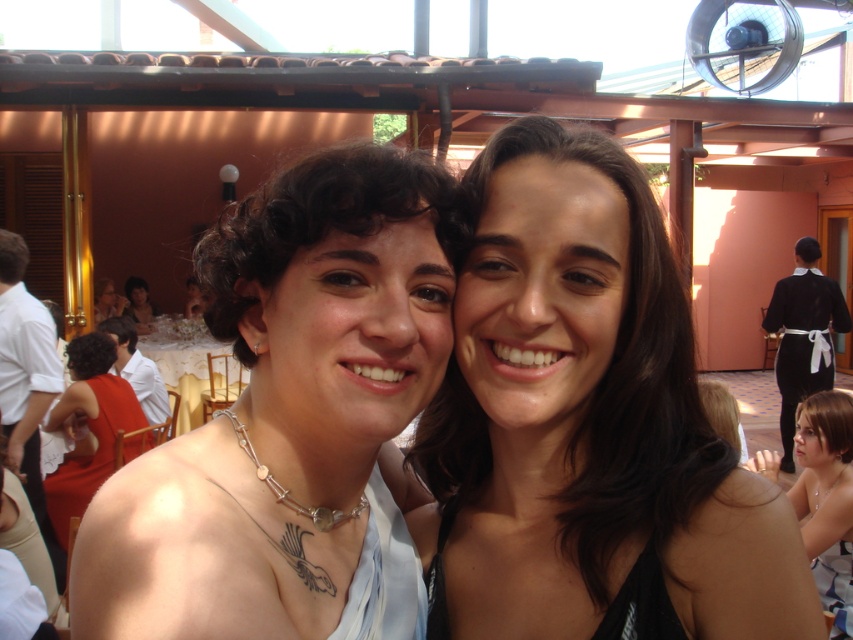
Which of these two, matte black dress at upper left or matte black dress at center, stands taller?

matte black dress at upper left is taller.

Who is lower down, matte black dress at upper left or matte black dress at center?

matte black dress at upper left

Identify the location of matte black dress at upper left. This screenshot has width=853, height=640. (138, 304).

Can you confirm if matte red dress at left is bigger than matte black dress at center?

Correct, matte red dress at left is larger in size than matte black dress at center.

Who is shorter, matte red dress at left or matte black dress at center?

With less height is matte black dress at center.

Does point (94, 416) lie in front of point (103, 316)?

Yes.

Identify the location of matte red dress at left. Image resolution: width=853 pixels, height=640 pixels. click(x=88, y=426).

From the picture: Can you confirm if matte silver necklace at center is positioned above black satin waiter at right?

Indeed, matte silver necklace at center is positioned over black satin waiter at right.

Is matte silver necklace at center thinner than black satin waiter at right?

Yes.

I want to click on matte silver necklace at center, so (x=283, y=412).